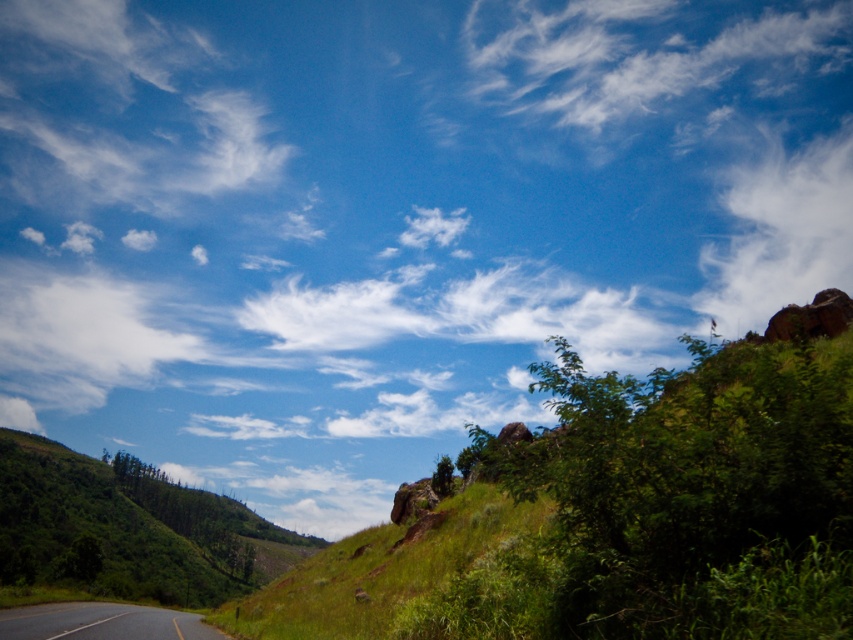
Question: Which point is closer to the camera taking this photo?

Choices:
 (A) (247, 308)
 (B) (766, 177)

Answer: (A)

Question: Does white wispy cloud at upper center appear on the right side of white fluffy cloud at upper right?

Choices:
 (A) no
 (B) yes

Answer: (A)

Question: Among these points, which one is farthest from the camera?

Choices:
 (A) (299, 289)
 (B) (65, 502)
 (C) (21, 628)
 (D) (780, 182)

Answer: (D)

Question: Estimate the real-world distances between objects in this image. Which object is farther from the green grassy hillside at lower left?

Choices:
 (A) white fluffy cloud at upper center
 (B) white fluffy cloud at upper right

Answer: (B)

Question: Is white wispy cloud at upper center above white fluffy cloud at upper right?

Choices:
 (A) no
 (B) yes

Answer: (B)

Question: Can you confirm if white fluffy cloud at upper center is positioned below black asphalt road at lower left?

Choices:
 (A) no
 (B) yes

Answer: (A)